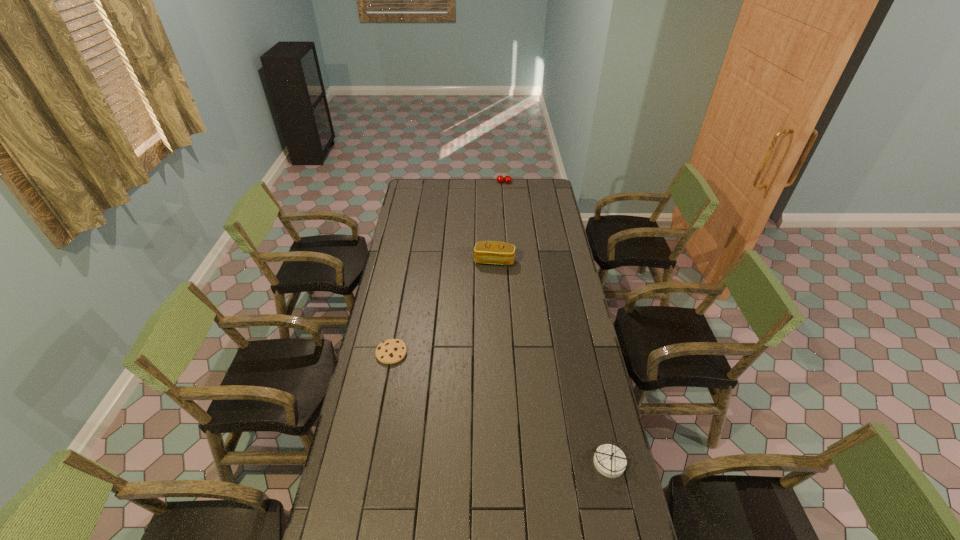
In the image, there is a desktop. Where is `free space at the right edge`? The width and height of the screenshot is (960, 540). free space at the right edge is located at coordinates (565, 238).

Image resolution: width=960 pixels, height=540 pixels. In order to click on free region at the far left corner in this screenshot , I will do `click(434, 181)`.

Find the location of a particular element. The width and height of the screenshot is (960, 540). free space at the far right corner is located at coordinates (530, 190).

Find the location of `free spot between the third nearest object and the farthest object`. free spot between the third nearest object and the farthest object is located at coordinates (499, 221).

At what (x,y) coordinates should I click in order to perform the action: click on vacant point located between the clutch bag and the third farthest object. Please return your answer as a coordinate pair (x, y). The width and height of the screenshot is (960, 540). Looking at the image, I should click on (443, 307).

The height and width of the screenshot is (540, 960). I want to click on free area in between the tallest object and the second shortest object, so click(x=557, y=323).

Locate an element on the screen. This screenshot has width=960, height=540. vacant area between the nearest object and the clutch bag is located at coordinates (552, 362).

Image resolution: width=960 pixels, height=540 pixels. I want to click on free spot between the cookie and the compass, so click(x=500, y=408).

Image resolution: width=960 pixels, height=540 pixels. I want to click on empty space between the second farthest object and the rightmost object, so click(x=552, y=362).

Image resolution: width=960 pixels, height=540 pixels. In order to click on free space between the tallest object and the second shortest object in this screenshot , I will do `click(557, 323)`.